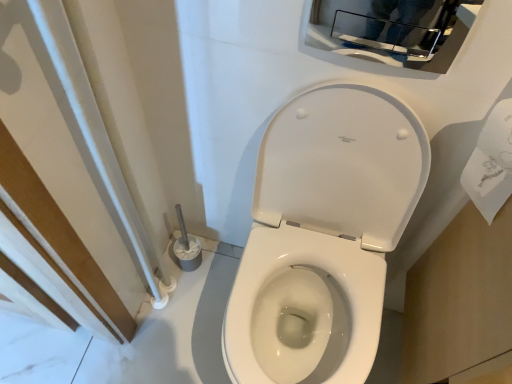
Question: Does glossy chrome medicine cabinet at upper center have a greater width compared to white glossy toilet at center?

Choices:
 (A) no
 (B) yes

Answer: (A)

Question: Is glossy chrome medicine cabinet at upper center touching white glossy toilet at center?

Choices:
 (A) no
 (B) yes

Answer: (A)

Question: Does glossy chrome medicine cabinet at upper center have a smaller size compared to white glossy toilet at center?

Choices:
 (A) yes
 (B) no

Answer: (A)

Question: Is glossy chrome medicine cabinet at upper center aimed at white glossy toilet at center?

Choices:
 (A) no
 (B) yes

Answer: (A)

Question: Does glossy chrome medicine cabinet at upper center come behind white glossy toilet at center?

Choices:
 (A) no
 (B) yes

Answer: (B)

Question: From a real-world perspective, does glossy chrome medicine cabinet at upper center stand above white glossy toilet at center?

Choices:
 (A) yes
 (B) no

Answer: (A)

Question: Is the depth of white paper towel at right greater than that of white glossy toilet at center?

Choices:
 (A) no
 (B) yes

Answer: (B)

Question: Can you confirm if white paper towel at right is positioned to the left of white glossy toilet at center?

Choices:
 (A) no
 (B) yes

Answer: (A)

Question: From the image's perspective, is white paper towel at right located beneath white glossy toilet at center?

Choices:
 (A) yes
 (B) no

Answer: (B)

Question: Is white paper towel at right positioned with its back to white glossy toilet at center?

Choices:
 (A) no
 (B) yes

Answer: (A)

Question: Is white paper towel at right completely or partially outside of white glossy toilet at center?

Choices:
 (A) yes
 (B) no

Answer: (A)

Question: Considering the relative sizes of white paper towel at right and white glossy toilet at center in the image provided, is white paper towel at right bigger than white glossy toilet at center?

Choices:
 (A) yes
 (B) no

Answer: (B)

Question: Is white glossy toilet at center next to glossy chrome medicine cabinet at upper center and touching it?

Choices:
 (A) yes
 (B) no

Answer: (B)